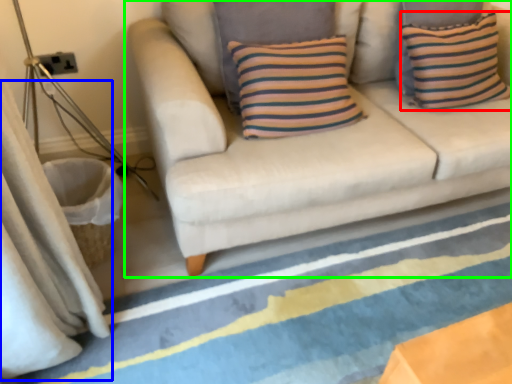
Question: Which object is the farthest from pillow (highlighted by a red box)? Choose among these: curtain (highlighted by a blue box) or studio couch (highlighted by a green box).

Choices:
 (A) curtain
 (B) studio couch

Answer: (A)